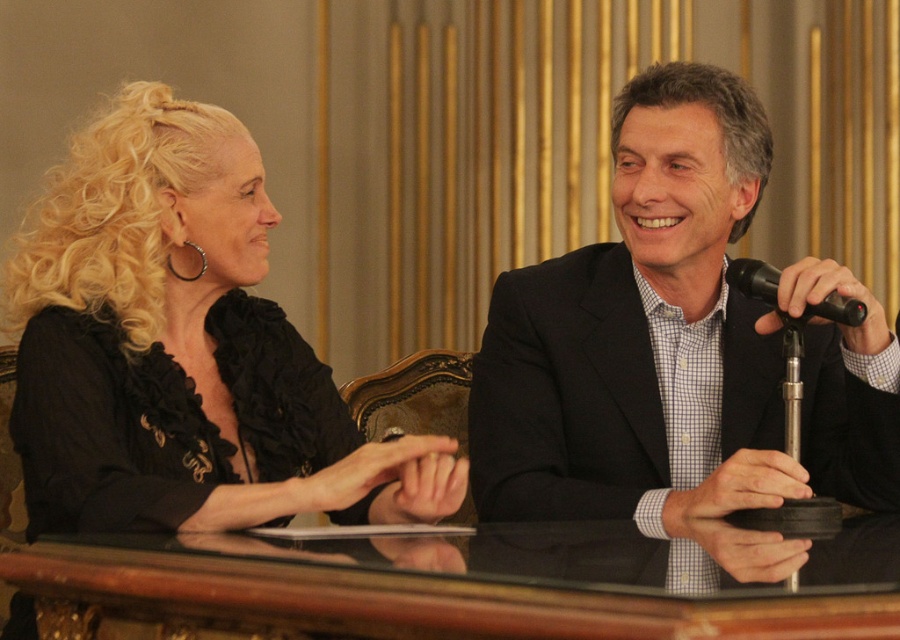
Who is lower down, black matte suit at center or black satin blouse at left?

black satin blouse at left

Looking at this image, does black matte suit at center lie in front of black satin blouse at left?

That is True.

In order to click on black matte suit at center in this screenshot , I will do `click(678, 355)`.

Can you confirm if black satin blouse at left is shorter than black plastic microphone at right?

No, black satin blouse at left is not shorter than black plastic microphone at right.

The image size is (900, 640). What do you see at coordinates (182, 349) in the screenshot? I see `black satin blouse at left` at bounding box center [182, 349].

Does point (238, 380) lie behind point (779, 272)?

That is True.

Where is `black satin blouse at left`? black satin blouse at left is located at coordinates (182, 349).

Can you confirm if transparent glass table at center is taller than black plastic microphone at right?

No, transparent glass table at center is not taller than black plastic microphone at right.

Is transparent glass table at center wider than black plastic microphone at right?

Yes, transparent glass table at center is wider than black plastic microphone at right.

The image size is (900, 640). Identify the location of transparent glass table at center. (448, 586).